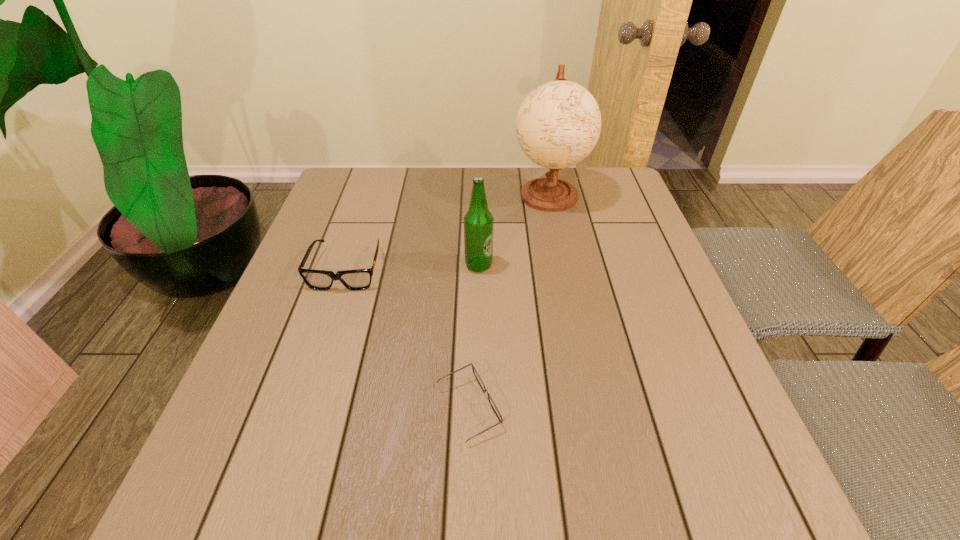
You are a GUI agent. You are given a task and a screenshot of the screen. Output one action in this format:
    pyautogui.click(x=<x>, y=<y>)
    Task: Click on the unoccupied position between the globe and the leftmost object
    This screenshot has width=960, height=540.
    Given the screenshot: What is the action you would take?
    pyautogui.click(x=447, y=232)

You are a GUI agent. You are given a task and a screenshot of the screen. Output one action in this format:
    pyautogui.click(x=<x>, y=<y>)
    Task: Click on the free space between the farthest object and the spectacles
    
    Given the screenshot: What is the action you would take?
    pyautogui.click(x=509, y=302)

This screenshot has width=960, height=540. Find the location of `blank region between the beer bottle and the shortest object`. blank region between the beer bottle and the shortest object is located at coordinates (474, 337).

I want to click on empty space between the second tallest object and the shortest object, so click(x=474, y=337).

Find the location of a particular element. The image size is (960, 540). free space that is in between the leftmost object and the tallest object is located at coordinates (447, 232).

Find the location of a particular element. This screenshot has width=960, height=540. free space that is in between the third shortest object and the farthest object is located at coordinates (514, 230).

Identify the location of free point between the spectacles and the third tallest object. (408, 339).

Identify the location of free space between the globe and the beer bottle. The width and height of the screenshot is (960, 540). (514, 230).

Image resolution: width=960 pixels, height=540 pixels. Find the location of `free spot between the third shortest object and the nearest object`. free spot between the third shortest object and the nearest object is located at coordinates click(x=474, y=337).

At what (x,y) coordinates should I click in order to perform the action: click on vacant area between the sunglasses and the shortest object. Please return your answer as a coordinate pair (x, y). Looking at the image, I should click on (408, 339).